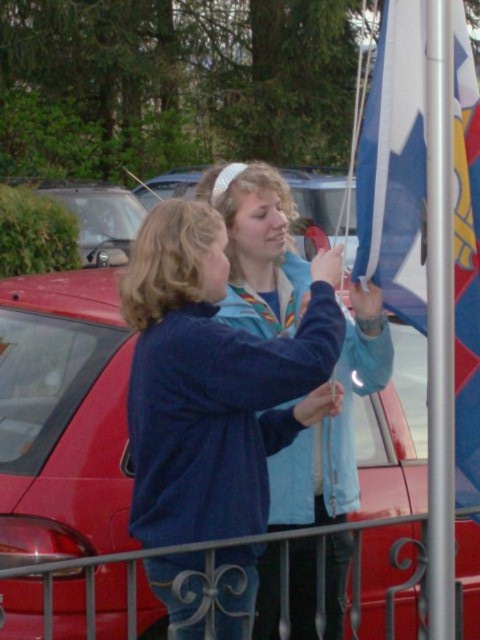
You are a photographer standing in front of the scene. You want to take a photo of the blue fabric flag at right without the blue fleece jacket at center blocking it. Is it possible to adjust your position to achieve this?

The blue fabric flag at right is behind the blue fleece jacket at center, so you cannot take a photo of the blue fabric flag at right without the blue fleece jacket at center blocking it by adjusting your position.

You are standing in front of the two individuals holding the flag. There are two points marked on the flagpole. Which point is closer to you, point at coordinate (69, 579) or point at coordinate (241, 284)?

Point at coordinate (69, 579) is closer to you than point at coordinate (241, 284).

You are a photographer standing in front of the scene. You need to take a photo that includes both the blue fleece jacket at center and the blue fabric flag at right. Based on their sizes, which object should be placed closer to the camera to ensure both are visible in the frame?

The blue fleece jacket at center is much taller than the blue fabric flag at right. To ensure both are visible, the blue fabric flag at right should be placed closer to the camera since it is smaller, allowing the taller jacket to still fit within the frame.